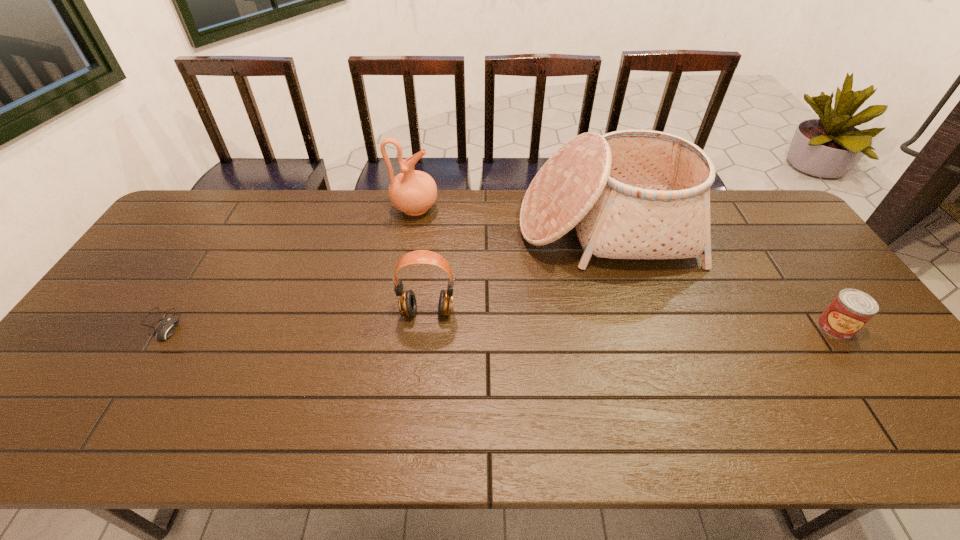
At what (x,y) coordinates should I click in order to perform the action: click on vacant region at the near left corner of the desktop. Please return your answer as a coordinate pair (x, y). The image size is (960, 540). Looking at the image, I should click on (30, 430).

In the image, there is a desktop. At what (x,y) coordinates should I click in order to perform the action: click on vacant space at the far right corner. Please return your answer as a coordinate pair (x, y). The width and height of the screenshot is (960, 540). Looking at the image, I should click on (743, 210).

The image size is (960, 540). What are the coordinates of `empty location between the pottery and the basket` in the screenshot? It's located at (510, 219).

Find the location of `free space between the leftmost object and the third tallest object`. free space between the leftmost object and the third tallest object is located at coordinates (294, 318).

At what (x,y) coordinates should I click in order to perform the action: click on free space that is in between the basket and the computer mouse. Please return your answer as a coordinate pair (x, y). This screenshot has height=540, width=960. Looking at the image, I should click on (382, 276).

Find the location of `free space between the basket and the pottery`. free space between the basket and the pottery is located at coordinates (510, 219).

Locate an element on the screen. The image size is (960, 540). vacant point located between the can and the pottery is located at coordinates 625,268.

You are a GUI agent. You are given a task and a screenshot of the screen. Output one action in this format:
    pyautogui.click(x=<x>, y=<y>)
    Task: Click on the vacant space in between the leftmost object and the fourth object from left to right
    The image size is (960, 540).
    Given the screenshot: What is the action you would take?
    pyautogui.click(x=382, y=276)

This screenshot has height=540, width=960. In order to click on empty space between the leftmost object and the can in this screenshot , I will do `click(497, 326)`.

This screenshot has height=540, width=960. Identify the location of free spot between the computer mouse and the can. (497, 326).